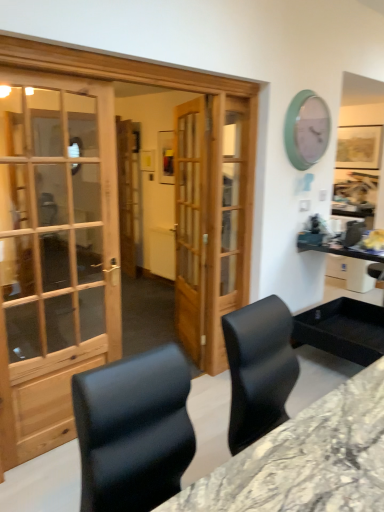
Question: Is marble/black desk at center completely or partially inside wooden door at center?

Choices:
 (A) yes
 (B) no

Answer: (B)

Question: From the image's perspective, is wooden door at center located beneath marble/black desk at center?

Choices:
 (A) no
 (B) yes

Answer: (A)

Question: Is wooden door at center not within marble/black desk at center?

Choices:
 (A) no
 (B) yes

Answer: (B)

Question: Would you say wooden door at center is a long distance from marble/black desk at center?

Choices:
 (A) yes
 (B) no

Answer: (A)

Question: Can you confirm if wooden door at center is taller than marble/black desk at center?

Choices:
 (A) no
 (B) yes

Answer: (B)

Question: Does wooden door at center have a lesser width compared to marble/black desk at center?

Choices:
 (A) no
 (B) yes

Answer: (B)

Question: Is teal plastic clock at upper right positioned with its back to wooden door at center?

Choices:
 (A) no
 (B) yes

Answer: (A)

Question: Is teal plastic clock at upper right positioned beyond the bounds of wooden door at center?

Choices:
 (A) yes
 (B) no

Answer: (A)

Question: Does teal plastic clock at upper right turn towards wooden door at center?

Choices:
 (A) yes
 (B) no

Answer: (B)

Question: Is teal plastic clock at upper right in contact with wooden door at center?

Choices:
 (A) no
 (B) yes

Answer: (A)

Question: Can you confirm if teal plastic clock at upper right is bigger than wooden door at center?

Choices:
 (A) no
 (B) yes

Answer: (A)

Question: Does teal plastic clock at upper right have a lesser width compared to wooden door at center?

Choices:
 (A) yes
 (B) no

Answer: (B)

Question: From the image's perspective, is teal plastic clock at upper right beneath marble/black desk at center?

Choices:
 (A) no
 (B) yes

Answer: (A)